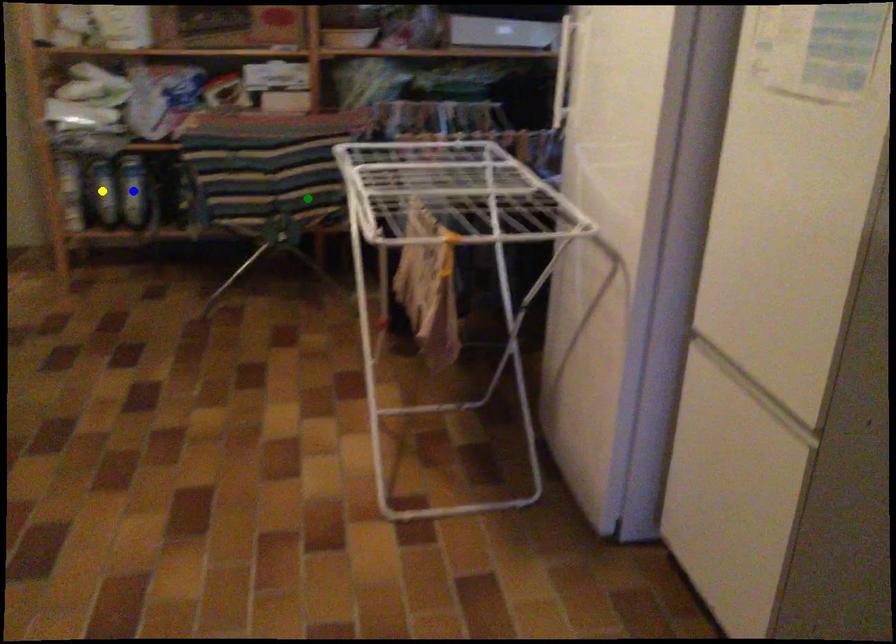
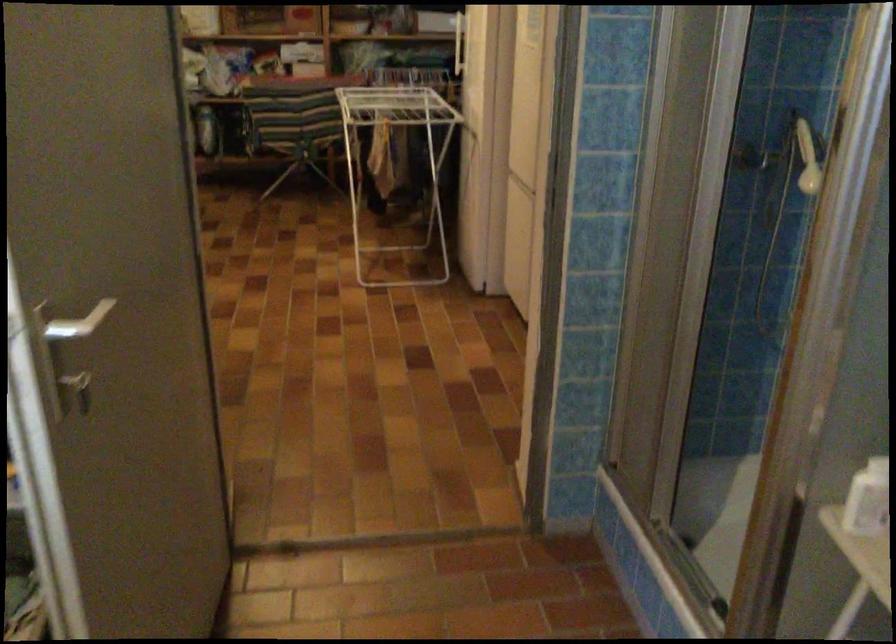
I am providing you with two images of the same scene from different viewpoints. Three points are marked in image1. Which point corresponds to a part or object that is occluded in image2?In image1, three points are marked. Which of them correspond to a part or object that is occluded in image2?Among the three points shown in image1, which one corresponds to a part or object that is no longer visible due to occlusion in image2?

Invisible in image2: yellow point, blue point.